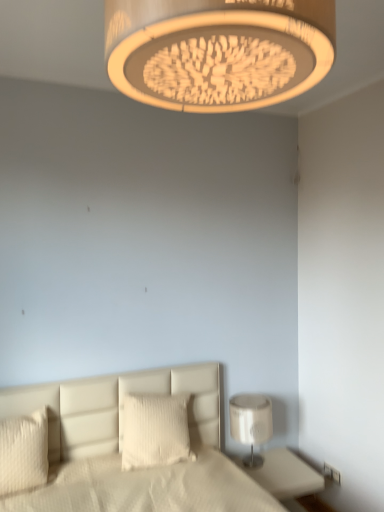
What do you see at coordinates (284, 474) in the screenshot? Image resolution: width=384 pixels, height=512 pixels. I see `white glossy nightstand at lower right` at bounding box center [284, 474].

At what (x,y) coordinates should I click in order to perform the action: click on white textured pillow at lower left, the first pillow viewed from the front. Please return your answer as a coordinate pair (x, y). This screenshot has width=384, height=512. Looking at the image, I should click on (24, 452).

Measure the distance between point (42, 440) and camera.

Point (42, 440) is 2.00 meters away from camera.

Identify the location of matte beige lampshade at upper center, the first lamp in the left-to-right sequence. The image size is (384, 512). (218, 51).

In the scene shown: What is the approximate width of matte beige lampshade at upper center, which is counted as the second lamp, starting from the back?

It is 18.58 inches.

At what (x,y) coordinates should I click in order to perform the action: click on white glossy nightstand at lower right. Please return your answer as a coordinate pair (x, y). This screenshot has height=512, width=384. Looking at the image, I should click on (284, 474).

Is white textured pillow at lower left, acting as the 2th pillow starting from the back, completely or partially inside white glossy nightstand at lower right?

No, white textured pillow at lower left, acting as the 2th pillow starting from the back, is located outside of white glossy nightstand at lower right.

Is there a large distance between white glossy nightstand at lower right and white textured pillow at lower left, the first pillow viewed from the front?

Yes, white glossy nightstand at lower right is far from white textured pillow at lower left, the first pillow viewed from the front.

Find the location of a particular element. This screenshot has height=512, width=384. nightstand below the white textured pillow at lower left, the first pillow viewed from the front (from a real-world perspective) is located at coordinates (284, 474).

What's the angular difference between white glossy nightstand at lower right and white textured pillow at lower left, acting as the 2th pillow starting from the back,'s facing directions?

6.31 degrees.

Is the position of matte beige lampshade at upper center, the first lamp in the left-to-right sequence, less distant than that of white leather bed at lower center?

Yes.

Does point (161, 95) appear closer or farther from the camera than point (86, 436)?

Point (161, 95) is closer to the camera than point (86, 436).

Between matte beige lampshade at upper center, the first lamp in the left-to-right sequence, and white leather bed at lower center, which one has less height?

matte beige lampshade at upper center, the first lamp in the left-to-right sequence.

Is matte beige lampshade at upper center, the 1th lamp positioned from the front, positioned beyond the bounds of white leather bed at lower center?

Yes, matte beige lampshade at upper center, the 1th lamp positioned from the front, is located beyond the bounds of white leather bed at lower center.

Who is taller, matte beige lampshade at upper center, the first lamp in the left-to-right sequence, or white textured pillow at lower left, acting as the 2th pillow starting from the back?

matte beige lampshade at upper center, the first lamp in the left-to-right sequence, is taller.

The height and width of the screenshot is (512, 384). I want to click on lamp that is in front of the white textured pillow at lower left, the first pillow viewed from the front, so click(218, 51).

Is matte beige lampshade at upper center, marked as the second lamp in a bottom-to-top arrangement, oriented away from white textured pillow at lower left, the 2th pillow viewed from the right?

No, matte beige lampshade at upper center, marked as the second lamp in a bottom-to-top arrangement,'s orientation is not away from white textured pillow at lower left, the 2th pillow viewed from the right.

Between white plastic electric outlet at lower right and white textured pillow at lower left, arranged as the 1th pillow when viewed from the left, which one has larger width?

white textured pillow at lower left, arranged as the 1th pillow when viewed from the left, is wider.

Which of these two, white plastic electric outlet at lower right or white textured pillow at lower left, acting as the 2th pillow starting from the back, is smaller?

With smaller size is white plastic electric outlet at lower right.

In the scene shown: Is white plastic electric outlet at lower right aimed at white textured pillow at lower left, the first pillow viewed from the front?

Yes, white plastic electric outlet at lower right is turned towards white textured pillow at lower left, the first pillow viewed from the front.

Where is `pillow that is the 1st one above the white plastic electric outlet at lower right (from a real-world perspective)`? pillow that is the 1st one above the white plastic electric outlet at lower right (from a real-world perspective) is located at coordinates (24, 452).

Considering the positions of point (257, 433) and point (285, 46), is point (257, 433) closer or farther from the camera than point (285, 46)?

Point (257, 433) is farther from the camera than point (285, 46).

Considering the sizes of objects white glossy lamp at lower right, the 1th lamp ordered from the bottom, and matte beige lampshade at upper center, marked as the second lamp in a bottom-to-top arrangement, in the image provided, who is taller, white glossy lamp at lower right, the 1th lamp ordered from the bottom, or matte beige lampshade at upper center, marked as the second lamp in a bottom-to-top arrangement,?

Standing taller between the two is white glossy lamp at lower right, the 1th lamp ordered from the bottom.

Locate an element on the screen. The image size is (384, 512). lamp on the right of matte beige lampshade at upper center, the second lamp in the right-to-left sequence is located at coordinates (251, 423).

In the scene shown: Is white glossy lamp at lower right, the first lamp from the back, oriented towards matte beige lampshade at upper center, placed as the 1th lamp when sorted from top to bottom?

No, white glossy lamp at lower right, the first lamp from the back, does not turn towards matte beige lampshade at upper center, placed as the 1th lamp when sorted from top to bottom.

How far apart are white leather bed at lower center and white glossy lamp at lower right, the 1th lamp ordered from the bottom?

white leather bed at lower center and white glossy lamp at lower right, the 1th lamp ordered from the bottom, are 22.17 inches apart.

Based on the photo, from the image's perspective, is white leather bed at lower center below white glossy lamp at lower right, the second lamp when ordered from top to bottom?

No, from the image's perspective, white leather bed at lower center is not below white glossy lamp at lower right, the second lamp when ordered from top to bottom.

Could you tell me if white leather bed at lower center is turned towards white glossy lamp at lower right, the 2th lamp when ordered from left to right?

No, white leather bed at lower center is not turned towards white glossy lamp at lower right, the 2th lamp when ordered from left to right.

Consider the image. Is white textured pillow at center, which is the 1th pillow from back to front, looking in the opposite direction of white leather bed at lower center?

That's right, white textured pillow at center, which is the 1th pillow from back to front, is facing away from white leather bed at lower center.

In terms of size, does white textured pillow at center, the 2th pillow positioned from the front, appear bigger or smaller than white leather bed at lower center?

In the image, white textured pillow at center, the 2th pillow positioned from the front, appears to be smaller than white leather bed at lower center.

Considering the relative sizes of white textured pillow at center, the 2th pillow positioned from the front, and white leather bed at lower center in the image provided, is white textured pillow at center, the 2th pillow positioned from the front, taller than white leather bed at lower center?

No, white textured pillow at center, the 2th pillow positioned from the front, is not taller than white leather bed at lower center.

Is point (129, 419) positioned behind point (208, 493)?

Yes, it is behind point (208, 493).

Where is `the 2nd pillow to the left when counting from the white glossy nightstand at lower right`? Image resolution: width=384 pixels, height=512 pixels. the 2nd pillow to the left when counting from the white glossy nightstand at lower right is located at coordinates (24, 452).

You are a GUI agent. You are given a task and a screenshot of the screen. Output one action in this format:
    pyautogui.click(x=<x>, y=<y>)
    Task: Click on the bed below the matte beige lampshade at upper center, the first lamp in the left-to-right sequence (from a real-world perspective)
    The image size is (384, 512).
    Given the screenshot: What is the action you would take?
    pyautogui.click(x=118, y=448)

Looking at the image, which one is located further to matte beige lampshade at upper center, which is counted as the second lamp, starting from the back, white textured pillow at lower left, arranged as the 1th pillow when viewed from the left, or white glossy lamp at lower right, the 2th lamp when ordered from left to right?

white glossy lamp at lower right, the 2th lamp when ordered from left to right, is positioned further to the anchor matte beige lampshade at upper center, which is counted as the second lamp, starting from the back.

Which object lies nearer to the anchor point white glossy lamp at lower right, the 1th lamp positioned from the right, white textured pillow at center, marked as the second pillow in a left-to-right arrangement, or white glossy nightstand at lower right?

The object closer to white glossy lamp at lower right, the 1th lamp positioned from the right, is white glossy nightstand at lower right.

From the image, which object appears to be farther from matte beige lampshade at upper center, the first lamp in the left-to-right sequence, white plastic electric outlet at lower right or white textured pillow at lower left, the first pillow viewed from the front?

white plastic electric outlet at lower right.

Looking at this image, from the image, which object appears to be nearer to white glossy nightstand at lower right, white textured pillow at lower left, the first pillow viewed from the front, or white plastic electric outlet at lower right?

Based on the image, white plastic electric outlet at lower right appears to be nearer to white glossy nightstand at lower right.

Looking at this image, when comparing their distances from white glossy lamp at lower right, the 1th lamp positioned from the right, does white textured pillow at lower left, the 2th pillow viewed from the right, or matte beige lampshade at upper center, the first lamp in the left-to-right sequence, seem closer?

white textured pillow at lower left, the 2th pillow viewed from the right, lies closer to white glossy lamp at lower right, the 1th lamp positioned from the right, than the other object.

Considering their positions, is white glossy nightstand at lower right positioned further to white leather bed at lower center than white textured pillow at lower left, acting as the 2th pillow starting from the back?

The object further to white leather bed at lower center is white glossy nightstand at lower right.

Which object lies further to the anchor point white leather bed at lower center, white glossy nightstand at lower right or white plastic electric outlet at lower right?

The object further to white leather bed at lower center is white plastic electric outlet at lower right.

From the image, which object appears to be nearer to white textured pillow at lower left, the 2th pillow viewed from the right, white glossy nightstand at lower right or white plastic electric outlet at lower right?

white glossy nightstand at lower right is closer to white textured pillow at lower left, the 2th pillow viewed from the right.

Find the location of a particular element. bed that lies between matte beige lampshade at upper center, marked as the second lamp in a bottom-to-top arrangement, and white glossy nightstand at lower right from top to bottom is located at coordinates (118, 448).

You are a GUI agent. You are given a task and a screenshot of the screen. Output one action in this format:
    pyautogui.click(x=<x>, y=<y>)
    Task: Click on the nightstand between white leather bed at lower center and white plastic electric outlet at lower right in the front-back direction
    Image resolution: width=384 pixels, height=512 pixels.
    Given the screenshot: What is the action you would take?
    pyautogui.click(x=284, y=474)

Identify the location of bed between matte beige lampshade at upper center, the 1th lamp positioned from the front, and white plastic electric outlet at lower right, along the z-axis. The width and height of the screenshot is (384, 512). (118, 448).

You are a GUI agent. You are given a task and a screenshot of the screen. Output one action in this format:
    pyautogui.click(x=<x>, y=<y>)
    Task: Click on the nightstand between white leather bed at lower center and white glossy lamp at lower right, the 1th lamp positioned from the right, in the front-back direction
    
    Given the screenshot: What is the action you would take?
    pyautogui.click(x=284, y=474)